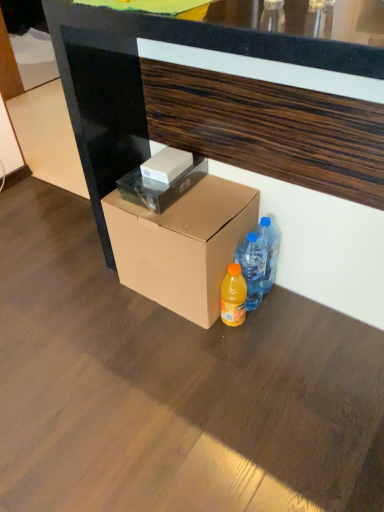
Where is `vacant space in front of white matte box at center, positioned as the third box in bottom-to-top order`? The image size is (384, 512). vacant space in front of white matte box at center, positioned as the third box in bottom-to-top order is located at coordinates (173, 218).